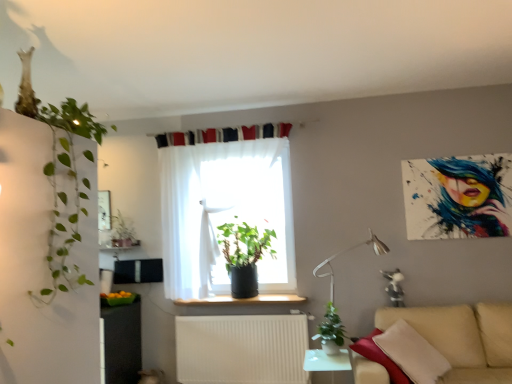
The width and height of the screenshot is (512, 384). What are the coordinates of `vacant space situated above white matte radiator at lower center (from a real-world perspective)` in the screenshot? It's located at pyautogui.click(x=229, y=311).